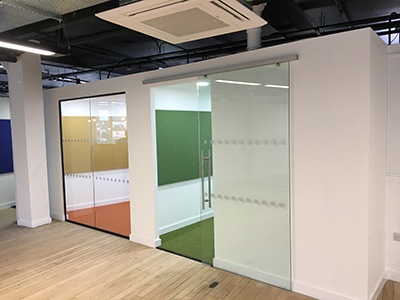
The height and width of the screenshot is (300, 400). I want to click on vent, so click(195, 23).